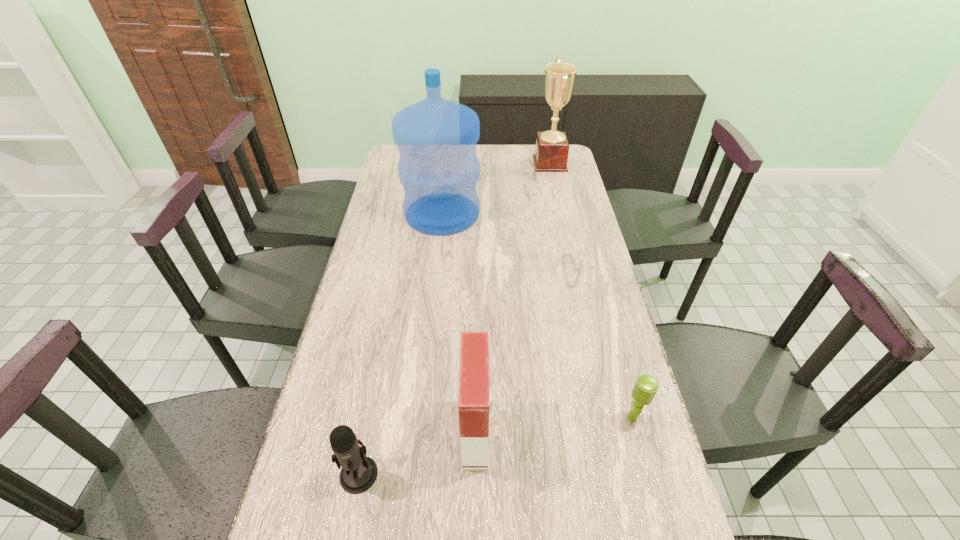
You are a GUI agent. You are given a task and a screenshot of the screen. Output one action in this format:
    pyautogui.click(x=<x>, y=<y>)
    Task: Click on the tallest object
    
    Given the screenshot: What is the action you would take?
    pyautogui.click(x=436, y=138)

Find the location of a particular element. The width and height of the screenshot is (960, 540). the second farthest object is located at coordinates (436, 138).

The image size is (960, 540). I want to click on the fourth shortest object, so click(552, 148).

Find the location of a particular element. The width and height of the screenshot is (960, 540). trophy cup is located at coordinates (552, 148).

Where is `the third tallest object`? The height and width of the screenshot is (540, 960). the third tallest object is located at coordinates (473, 402).

Locate an element on the screen. the left microphone is located at coordinates (359, 472).

You are a GUI agent. You are given a task and a screenshot of the screen. Output one action in this format:
    pyautogui.click(x=<x>, y=<y>)
    Task: Click on the nearer microphone
    
    Given the screenshot: What is the action you would take?
    pyautogui.click(x=359, y=472)

Where is `the shortest object`? The image size is (960, 540). the shortest object is located at coordinates [x=646, y=386].

Locate an element on the screen. Image resolution: width=960 pixels, height=540 pixels. the shorter microphone is located at coordinates (646, 386).

This screenshot has height=540, width=960. What are the coordinates of `vacant space located on the left of the water jug` in the screenshot? It's located at (386, 213).